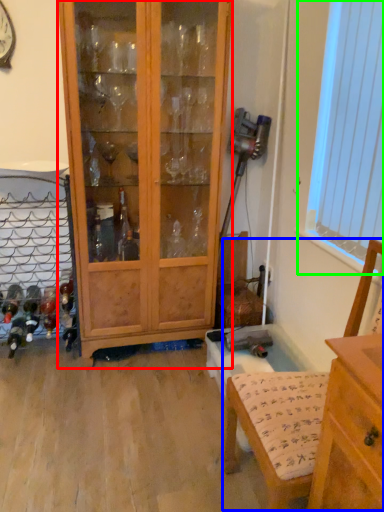
Question: Considering the real-world distances, which object is closest to cabinetry (highlighted by a red box)? armchair (highlighted by a blue box) or window screen (highlighted by a green box).

Choices:
 (A) armchair
 (B) window screen

Answer: (B)